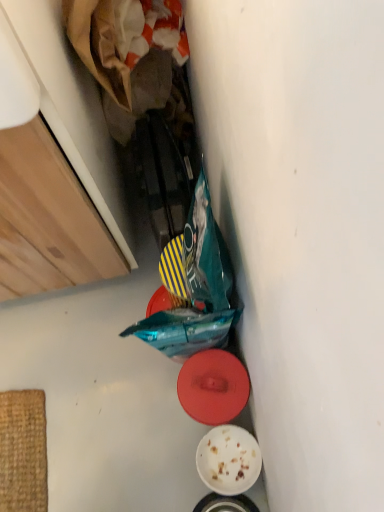
Question: From the image's perspective, is red matte plate at center, the second plate ordered from the bottom, above or below white matte plate at lower center, which is the first plate from bottom to top?

Choices:
 (A) below
 (B) above

Answer: (B)

Question: Is red matte plate at center, the second plate ordered from the bottom, taller or shorter than white matte plate at lower center, the 2th plate viewed from the top?

Choices:
 (A) tall
 (B) short

Answer: (A)

Question: Is red matte plate at center, the second plate ordered from the bottom, inside or outside of white matte plate at lower center, which is the first plate from bottom to top?

Choices:
 (A) inside
 (B) outside

Answer: (B)

Question: From their relative heights in the image, would you say white matte plate at lower center, which is the first plate from bottom to top, is taller or shorter than red matte plate at center, which is the 1th plate in top-to-bottom order?

Choices:
 (A) tall
 (B) short

Answer: (B)

Question: Is white matte plate at lower center, the 2th plate viewed from the top, inside or outside of red matte plate at center, the second plate ordered from the bottom?

Choices:
 (A) inside
 (B) outside

Answer: (B)

Question: In the image, is white matte plate at lower center, which is the first plate from bottom to top, on the left side or the right side of red matte plate at center, which is the 1th plate in top-to-bottom order?

Choices:
 (A) left
 (B) right

Answer: (B)

Question: Based on their sizes in the image, would you say white matte plate at lower center, the 2th plate viewed from the top, is bigger or smaller than red matte plate at center, the second plate ordered from the bottom?

Choices:
 (A) big
 (B) small

Answer: (B)